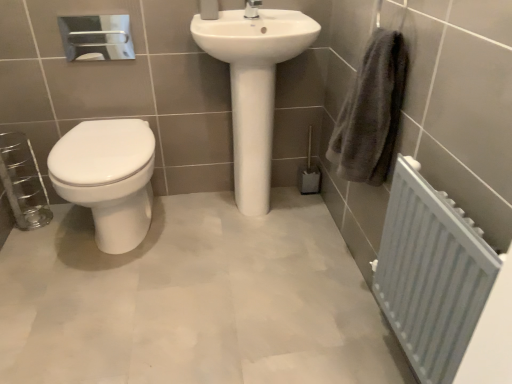
Question: Is white glossy toilet at left wider or thinner than polished chrome tap at upper center?

Choices:
 (A) wide
 (B) thin

Answer: (A)

Question: Does point (138, 175) appear closer or farther from the camera than point (249, 6)?

Choices:
 (A) farther
 (B) closer

Answer: (B)

Question: Which is farther from the gray cotton towel at right?

Choices:
 (A) white glossy sink at center
 (B) white glossy toilet at left
 (C) polished chrome tap at upper center
 (D) white painted metal radiator at lower right

Answer: (B)

Question: Based on their relative distances, which object is nearer to the white glossy toilet at left?

Choices:
 (A) white painted metal radiator at lower right
 (B) gray cotton towel at right
 (C) white glossy sink at center
 (D) polished chrome tap at upper center

Answer: (C)